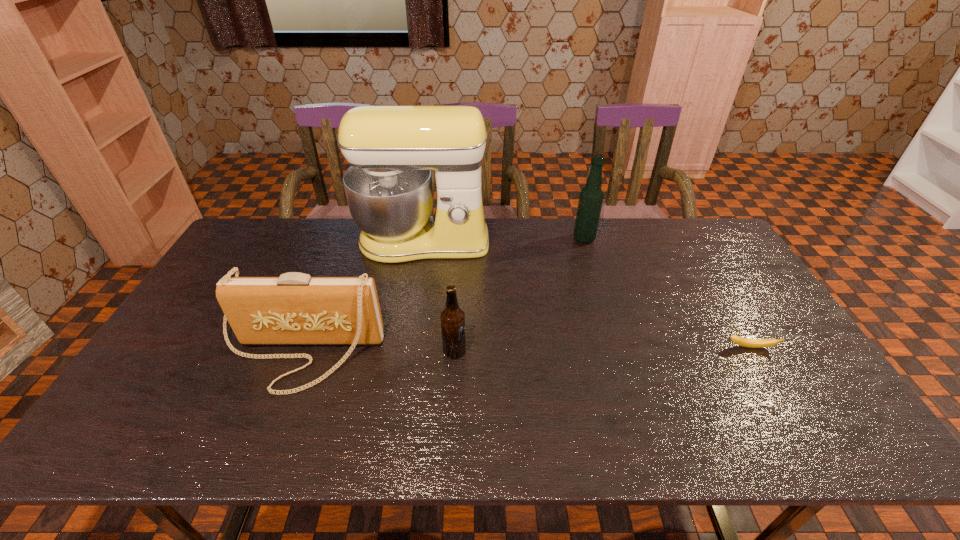
This screenshot has height=540, width=960. In the image, there is a desktop. In order to click on free region at the far right corner in this screenshot , I will do `click(730, 251)`.

Find the location of `free space between the banana and the handbag`. free space between the banana and the handbag is located at coordinates (525, 352).

Where is `free space between the alcohol and the handbag`? Image resolution: width=960 pixels, height=540 pixels. free space between the alcohol and the handbag is located at coordinates (442, 297).

The width and height of the screenshot is (960, 540). Identify the location of vacant area that lies between the fourth object from left to right and the tallest object. (504, 240).

This screenshot has width=960, height=540. I want to click on empty location between the mixer and the second object from right to left, so click(x=504, y=240).

Locate an element on the screen. The width and height of the screenshot is (960, 540). blank region between the mixer and the beer bottle is located at coordinates (439, 296).

Locate an element on the screen. vacant region between the second tallest object and the handbag is located at coordinates (442, 297).

What are the coordinates of `vacant region between the tallest object and the second tallest object` in the screenshot? It's located at (504, 240).

Where is `empty space that is in between the handbag and the rightmost object`? Image resolution: width=960 pixels, height=540 pixels. empty space that is in between the handbag and the rightmost object is located at coordinates (525, 352).

Find the location of a particular element. The height and width of the screenshot is (540, 960). unoccupied position between the beer bottle and the rightmost object is located at coordinates (603, 349).